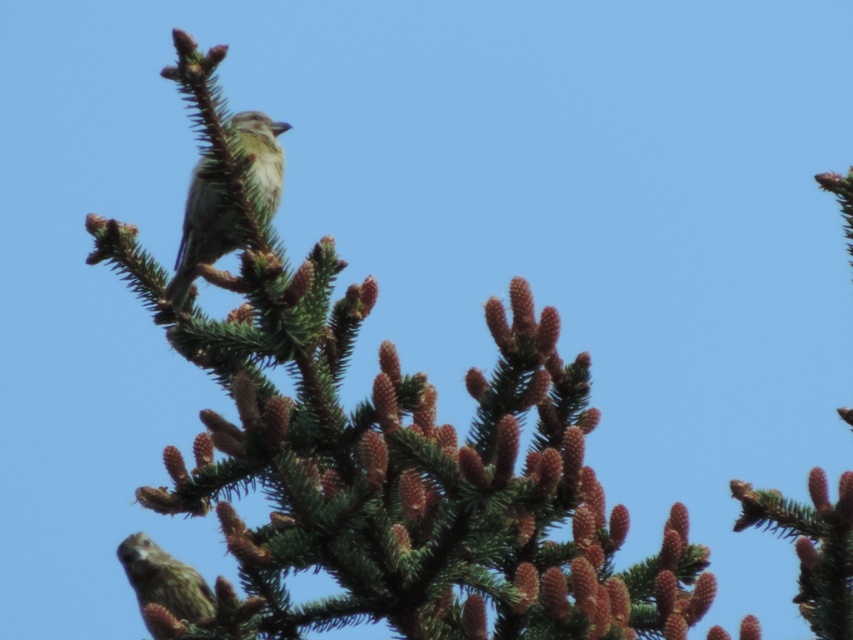
Question: Does green textured pine branch at upper center appear on the left side of brown speckled feathers at center?

Choices:
 (A) yes
 (B) no

Answer: (B)

Question: Which point is farther from the camera taking this photo?

Choices:
 (A) (376, 580)
 (B) (196, 188)

Answer: (B)

Question: Which of the following is the farthest from the observer?

Choices:
 (A) green speckled feathers at upper center
 (B) green textured pine branch at upper center

Answer: (A)

Question: Can you confirm if green textured pine branch at upper center is positioned above green speckled feathers at upper center?

Choices:
 (A) yes
 (B) no

Answer: (A)

Question: Is green textured pine branch at upper center bigger than green speckled feathers at upper center?

Choices:
 (A) yes
 (B) no

Answer: (A)

Question: Which object is the closest to the brown speckled feathers at center?

Choices:
 (A) green speckled feathers at upper center
 (B) green textured pine branch at upper center

Answer: (B)